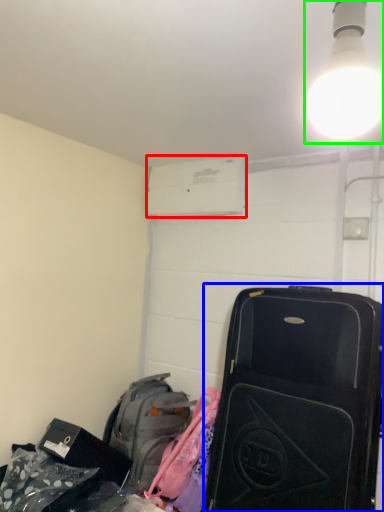
Question: Estimate the real-world distances between objects in this image. Which object is farther from air conditioning (highlighted by a red box), suitcase (highlighted by a blue box) or light fixture (highlighted by a green box)?

Choices:
 (A) suitcase
 (B) light fixture

Answer: (B)